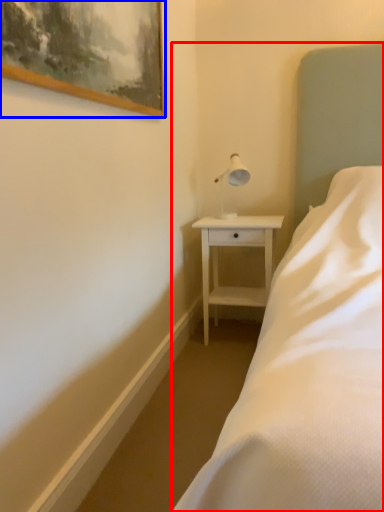
Question: Which object appears farthest to the camera in this image, bed (highlighted by a red box) or picture frame (highlighted by a blue box)?

Choices:
 (A) bed
 (B) picture frame

Answer: (B)